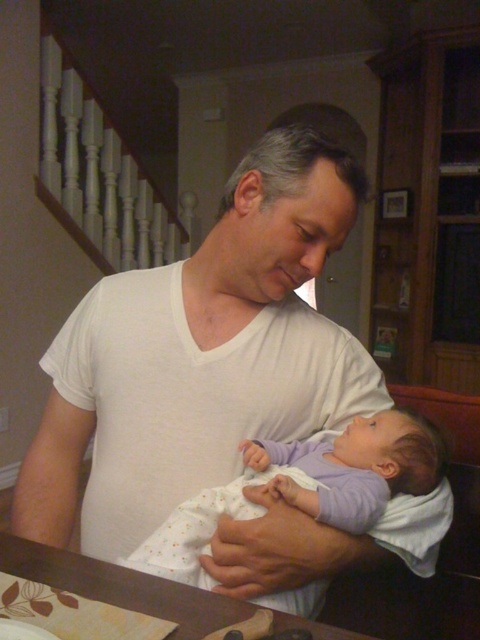
You are a photographer trying to capture a closeup shot of the baby while ensuring the man is still visible in the frame. Given the distance between the white soft shirt at center and the purple soft fabric baby at center, can you estimate whether your camera lens needs to be zoomed in or out to focus on the baby without cropping the man out of the image?

The white soft shirt at center and purple soft fabric baby at center are 5.47 inches apart from each other. To focus on the baby while keeping the man visible, you should zoom out slightly to ensure both the purple soft fabric baby at center and the white soft shirt at center remain in the frame.

From the picture: You are designing a photo frame that needs to accommodate both the white soft shirt at center and the purple soft fabric baby at center. Based on the scene, which object should be placed on the left side of the frame to ensure proper alignment?

The white soft shirt at center might be wider than purple soft fabric baby at center, so placing the wider white soft shirt at center on the left side would ensure proper alignment in the frame.